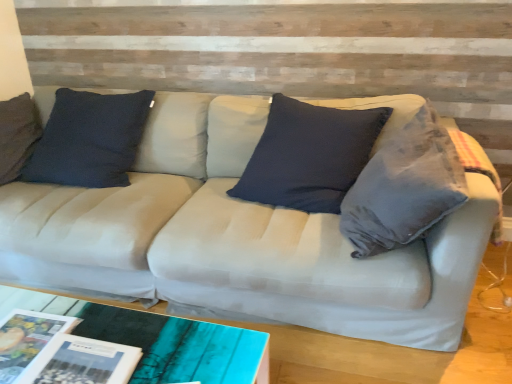
I want to click on free spot above matte paper magazine at lower left, which is the 2th magazine in right-to-left order (from a real-world perspective), so click(x=23, y=333).